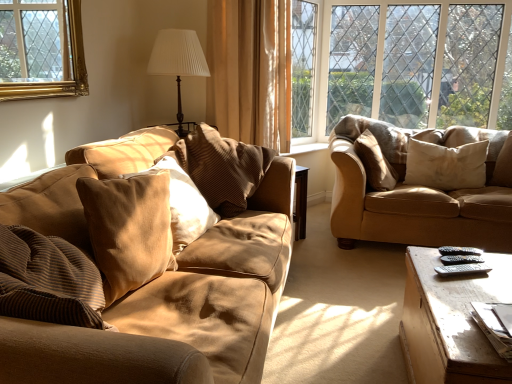
Question: Choose the correct answer: Is beige soft cushion at right, the 1th pillow when ordered from right to left, inside wooden coffee table at lower right or outside it?

Choices:
 (A) outside
 (B) inside

Answer: (A)

Question: From a real-world perspective, is beige soft cushion at right, the 1th pillow when ordered from right to left, physically located above or below wooden coffee table at lower right?

Choices:
 (A) below
 (B) above

Answer: (B)

Question: Estimate the real-world distances between objects in this image. Which object is closer to the suede beige couch at right, the second studio couch viewed from the left?

Choices:
 (A) brown striped pillow at center, which ranks as the 3th pillow in left-to-right order
 (B) white pleated fabric at upper center
 (C) suede-like beige pillow at center-left, marked as the 4th pillow in a right-to-left arrangement
 (D) clear glass window at upper right
 (E) suede-like brown couch at left, positioned as the 1th studio couch in left-to-right order

Answer: (A)

Question: Considering the real-world distances, which object is closest to the suede-like brown couch at left, acting as the first studio couch starting from the front?

Choices:
 (A) white pleated fabric at upper center
 (B) brown striped pillow at center, which ranks as the 3th pillow in left-to-right order
 (C) suede-like beige pillow at center-left, placed as the second pillow when sorted from left to right
 (D) suede beige couch at right, arranged as the 1th studio couch when viewed from the back
 (E) clear glass window at upper right

Answer: (C)